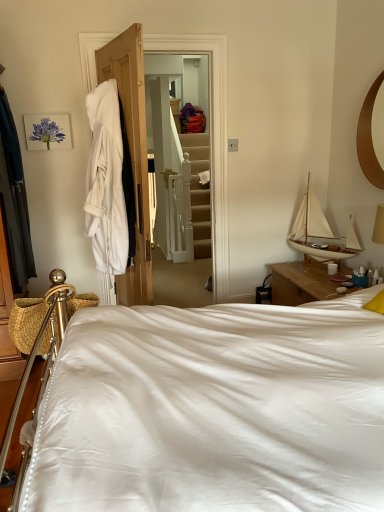
Question: Is white ceramic mug at upper right at the back of white cloth at left?

Choices:
 (A) yes
 (B) no

Answer: (B)

Question: Can you confirm if white cloth at left is thinner than white ceramic mug at upper right?

Choices:
 (A) yes
 (B) no

Answer: (B)

Question: Does white cloth at left have a smaller size compared to white ceramic mug at upper right?

Choices:
 (A) yes
 (B) no

Answer: (B)

Question: Is white cloth at left wider than white ceramic mug at upper right?

Choices:
 (A) yes
 (B) no

Answer: (A)

Question: Is white cloth at left closer to the viewer compared to white ceramic mug at upper right?

Choices:
 (A) yes
 (B) no

Answer: (A)

Question: Would you say white cloth at left is a long distance from white ceramic mug at upper right?

Choices:
 (A) yes
 (B) no

Answer: (A)

Question: Is matte purple flower at upper left not inside white ceramic mug at upper right?

Choices:
 (A) yes
 (B) no

Answer: (A)

Question: Is the surface of matte purple flower at upper left in direct contact with white ceramic mug at upper right?

Choices:
 (A) yes
 (B) no

Answer: (B)

Question: Does matte purple flower at upper left have a lesser height compared to white ceramic mug at upper right?

Choices:
 (A) yes
 (B) no

Answer: (B)

Question: From the image's perspective, does matte purple flower at upper left appear lower than white ceramic mug at upper right?

Choices:
 (A) yes
 (B) no

Answer: (B)

Question: From the image's perspective, would you say matte purple flower at upper left is positioned over white ceramic mug at upper right?

Choices:
 (A) yes
 (B) no

Answer: (A)

Question: Is matte purple flower at upper left thinner than white ceramic mug at upper right?

Choices:
 (A) no
 (B) yes

Answer: (B)

Question: From the image's perspective, is matte purple flower at upper left over white wood sailboat at upper right?

Choices:
 (A) no
 (B) yes

Answer: (B)